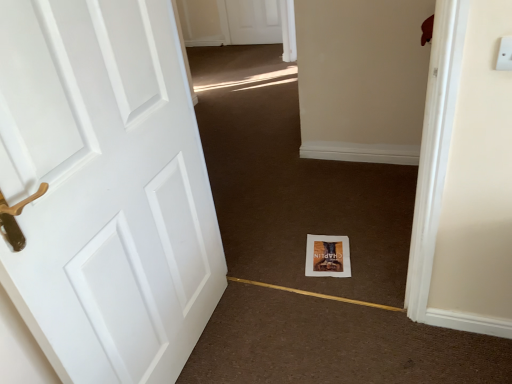
Question: Can you confirm if white paper at center is thinner than matte paper book at center?

Choices:
 (A) no
 (B) yes

Answer: (B)

Question: Does white paper at center appear on the right side of matte paper book at center?

Choices:
 (A) yes
 (B) no

Answer: (B)

Question: Is matte paper book at center located within white paper at center?

Choices:
 (A) yes
 (B) no

Answer: (B)

Question: From the image's perspective, is white paper at center on top of matte paper book at center?

Choices:
 (A) yes
 (B) no

Answer: (A)

Question: From a real-world perspective, does white paper at center stand above matte paper book at center?

Choices:
 (A) yes
 (B) no

Answer: (A)

Question: From their relative heights in the image, would you say white paper at center is taller or shorter than white plastic electric outlet at upper right?

Choices:
 (A) tall
 (B) short

Answer: (A)

Question: Is point (228, 271) closer or farther from the camera than point (510, 54)?

Choices:
 (A) closer
 (B) farther

Answer: (B)

Question: Is white paper at center wider or thinner than white plastic electric outlet at upper right?

Choices:
 (A) thin
 (B) wide

Answer: (B)

Question: In the image, is white paper at center positioned in front of or behind white plastic electric outlet at upper right?

Choices:
 (A) behind
 (B) front

Answer: (A)

Question: From a real-world perspective, is matte paper book at center positioned above or below white plastic electric outlet at upper right?

Choices:
 (A) above
 (B) below

Answer: (B)

Question: Looking at the image, does matte paper book at center seem bigger or smaller compared to white plastic electric outlet at upper right?

Choices:
 (A) big
 (B) small

Answer: (A)

Question: Is matte paper book at center taller or shorter than white plastic electric outlet at upper right?

Choices:
 (A) short
 (B) tall

Answer: (A)

Question: From the image's perspective, is matte paper book at center located above or below white plastic electric outlet at upper right?

Choices:
 (A) above
 (B) below

Answer: (B)

Question: From a real-world perspective, is white plastic electric outlet at upper right physically located above or below matte paper book at center?

Choices:
 (A) below
 (B) above

Answer: (B)

Question: From the image's perspective, is white plastic electric outlet at upper right positioned above or below matte paper book at center?

Choices:
 (A) below
 (B) above

Answer: (B)